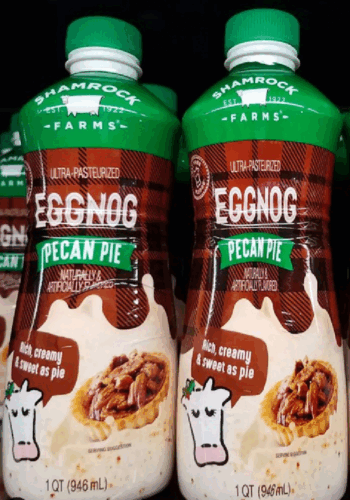
The image size is (350, 500). I want to click on left bottle, so click(12, 233).